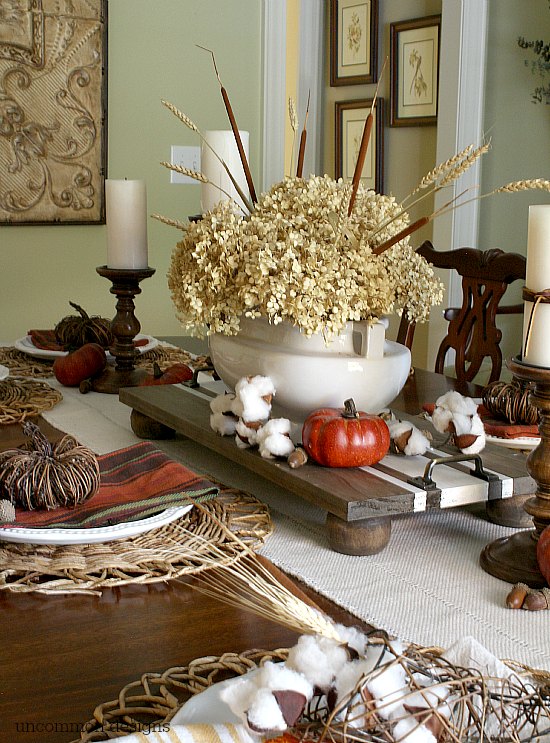
Find the location of a particular element. basket plate is located at coordinates (148, 548).